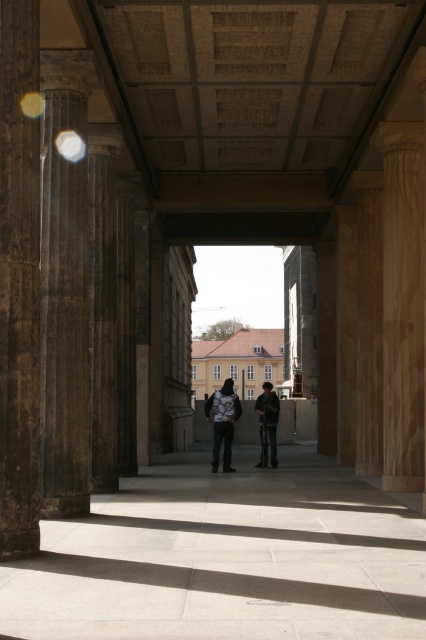
Can you confirm if dark brown stone pillar at left is bigger than dark gray jacket at center?

No, dark brown stone pillar at left is not bigger than dark gray jacket at center.

Which is below, dark brown stone pillar at left or dark gray jacket at center?

dark gray jacket at center

Identify the location of dark brown stone pillar at left. (19, 282).

Is point (75, 435) positioned behind point (264, 406)?

No.

Between dark brown polished column at left and dark gray jacket at center, which one has more height?

dark gray jacket at center

Does point (83, 163) come farther from viewer compared to point (264, 440)?

No, it is in front of (264, 440).

In order to click on dark brown polished column at left in this screenshot , I will do [65, 289].

In the scene shown: Who is shorter, dark gray backpack at center or dark gray jacket at center?

With less height is dark gray jacket at center.

Locate an element on the screen. Image resolution: width=426 pixels, height=640 pixels. dark gray backpack at center is located at coordinates (222, 422).